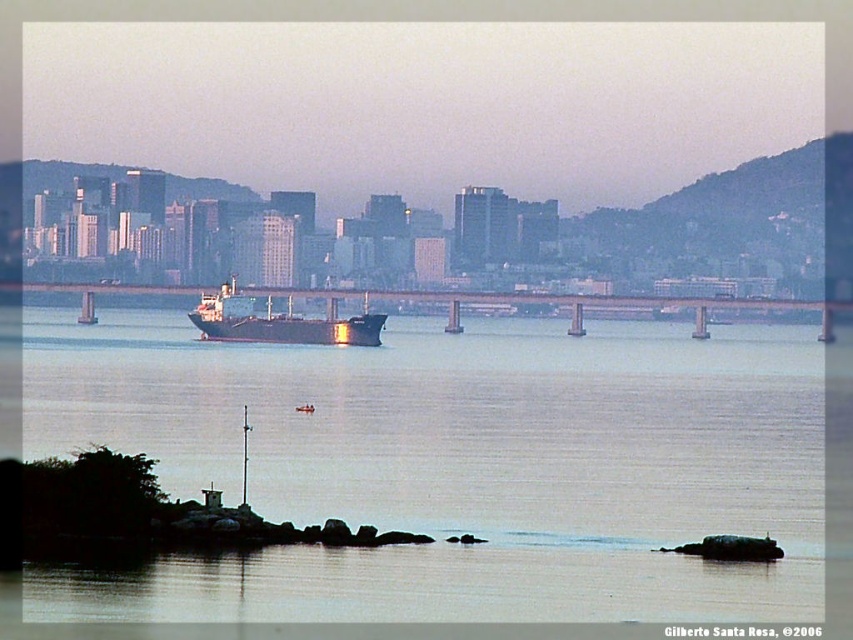
Question: Observing the image, what is the correct spatial positioning of smooth water at center in reference to metal bridge at center?

Choices:
 (A) right
 (B) left

Answer: (B)

Question: Does metal bridge at center have a larger size compared to shiny black ship at center?

Choices:
 (A) yes
 (B) no

Answer: (A)

Question: Can you confirm if smooth water at center is positioned above shiny black ship at center?

Choices:
 (A) yes
 (B) no

Answer: (B)

Question: Which is nearer to the smooth water at center?

Choices:
 (A) shiny black ship at center
 (B) metal bridge at center

Answer: (B)

Question: Which object is farther from the camera taking this photo?

Choices:
 (A) smooth water at center
 (B) shiny black ship at center
 (C) metal bridge at center

Answer: (C)

Question: Which point is closer to the camera?

Choices:
 (A) (347, 342)
 (B) (161, 285)
 (C) (271, 358)

Answer: (A)